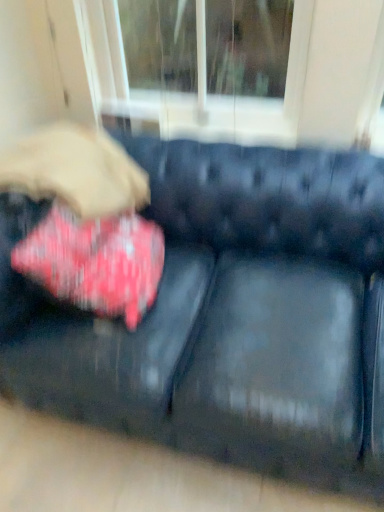
Question: Based on their positions, is red velvet cushion at left located to the left or right of black leather couch at center?

Choices:
 (A) right
 (B) left

Answer: (B)

Question: From the image's perspective, is red velvet cushion at left above or below black leather couch at center?

Choices:
 (A) above
 (B) below

Answer: (A)

Question: Is red velvet cushion at left situated inside black leather couch at center or outside?

Choices:
 (A) inside
 (B) outside

Answer: (A)

Question: Would you say black leather couch at center is inside or outside red velvet cushion at left?

Choices:
 (A) outside
 (B) inside

Answer: (A)

Question: From the image's perspective, is black leather couch at center positioned above or below red velvet cushion at left?

Choices:
 (A) below
 (B) above

Answer: (A)

Question: Relative to red velvet cushion at left, is black leather couch at center in front or behind?

Choices:
 (A) behind
 (B) front

Answer: (B)

Question: Considering the positions of black leather couch at center and red velvet cushion at left in the image, is black leather couch at center wider or thinner than red velvet cushion at left?

Choices:
 (A) wide
 (B) thin

Answer: (A)